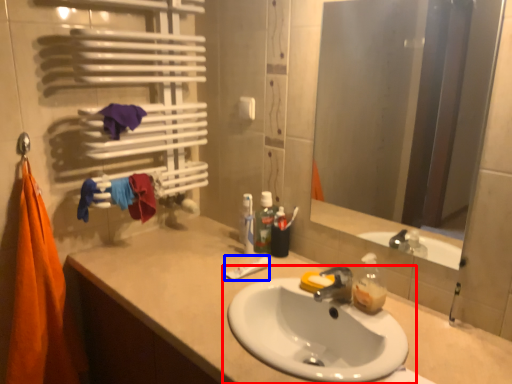
Question: Which point is further to the camera, sink (highlighted by a red box) or toothpaste (highlighted by a blue box)?

Choices:
 (A) sink
 (B) toothpaste

Answer: (B)